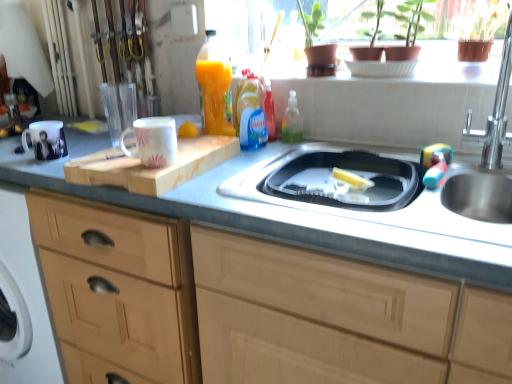
Question: Is wooden cutting board at center taller than stainless steel sink at center, which is the second sink from top to bottom?

Choices:
 (A) no
 (B) yes

Answer: (A)

Question: Is wooden cutting board at center at the left side of stainless steel sink at center, the 1th sink ordered from the bottom?

Choices:
 (A) no
 (B) yes

Answer: (B)

Question: Are wooden cutting board at center and stainless steel sink at center, which is the second sink from top to bottom, beside each other?

Choices:
 (A) yes
 (B) no

Answer: (B)

Question: Considering the relative positions of wooden cutting board at center and stainless steel sink at center, the 1th sink ordered from the bottom, in the image provided, is wooden cutting board at center to the right of stainless steel sink at center, the 1th sink ordered from the bottom, from the viewer's perspective?

Choices:
 (A) no
 (B) yes

Answer: (A)

Question: Is the depth of wooden cutting board at center less than that of stainless steel sink at center, which is the second sink from top to bottom?

Choices:
 (A) no
 (B) yes

Answer: (A)

Question: From the image's perspective, relative to wooden cabinet at left, placed as the 2th cabinetry when sorted from left to right, is yellow matte lemon at center, placed as the 1th food when sorted from top to bottom, above or below?

Choices:
 (A) below
 (B) above

Answer: (B)

Question: From a real-world perspective, is yellow matte lemon at center, the 2th food when ordered from right to left, above or below wooden cabinet at left, which is counted as the 1th cabinetry, starting from the right?

Choices:
 (A) below
 (B) above

Answer: (B)

Question: Is yellow matte lemon at center, placed as the 1th food when sorted from top to bottom, bigger or smaller than wooden cabinet at left, which is counted as the 1th cabinetry, starting from the right?

Choices:
 (A) big
 (B) small

Answer: (B)

Question: Is yellow matte lemon at center, the 1th food in the left-to-right sequence, in front of or behind wooden cabinet at left, which is counted as the 1th cabinetry, starting from the right, in the image?

Choices:
 (A) front
 (B) behind

Answer: (B)

Question: In the image, is stainless steel sink at center, which is the second sink from top to bottom, positioned in front of or behind stainless steel sink at right, which appears as the 2th sink when ordered from the bottom?

Choices:
 (A) front
 (B) behind

Answer: (A)

Question: Visually, is stainless steel sink at center, the 1th sink ordered from the bottom, positioned to the left or to the right of stainless steel sink at right, which appears as the 2th sink when ordered from the bottom?

Choices:
 (A) left
 (B) right

Answer: (A)

Question: From a real-world perspective, is stainless steel sink at center, which is the second sink from top to bottom, physically located above or below stainless steel sink at right, marked as the 1th sink in a top-to-bottom arrangement?

Choices:
 (A) above
 (B) below

Answer: (B)

Question: From the image's perspective, is stainless steel sink at center, which is the second sink from top to bottom, located above or below stainless steel sink at right, which appears as the 2th sink when ordered from the bottom?

Choices:
 (A) below
 (B) above

Answer: (A)

Question: In terms of height, does white glossy mug at upper center, the second mug when ordered from back to front, look taller or shorter compared to stainless steel sink at right, which appears as the 2th sink when ordered from the bottom?

Choices:
 (A) tall
 (B) short

Answer: (B)

Question: Relative to stainless steel sink at right, which appears as the 2th sink when ordered from the bottom, is white glossy mug at upper center, which is the 1th mug from front to back, in front or behind?

Choices:
 (A) front
 (B) behind

Answer: (B)